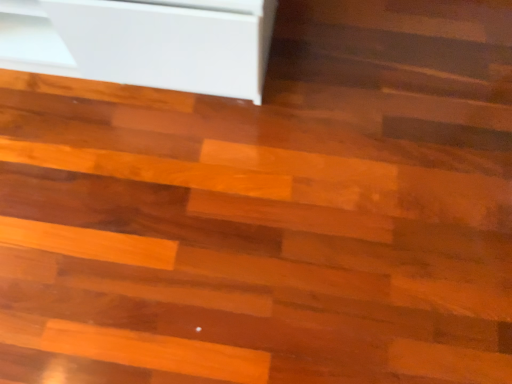
Find the location of a particular element. white glossy baseboard at upper left is located at coordinates (144, 42).

The width and height of the screenshot is (512, 384). What do you see at coordinates (144, 42) in the screenshot?
I see `white glossy baseboard at upper left` at bounding box center [144, 42].

What is the approximate width of white glossy baseboard at upper left?

The width of white glossy baseboard at upper left is 15.19 inches.

This screenshot has height=384, width=512. I want to click on white glossy baseboard at upper left, so click(144, 42).